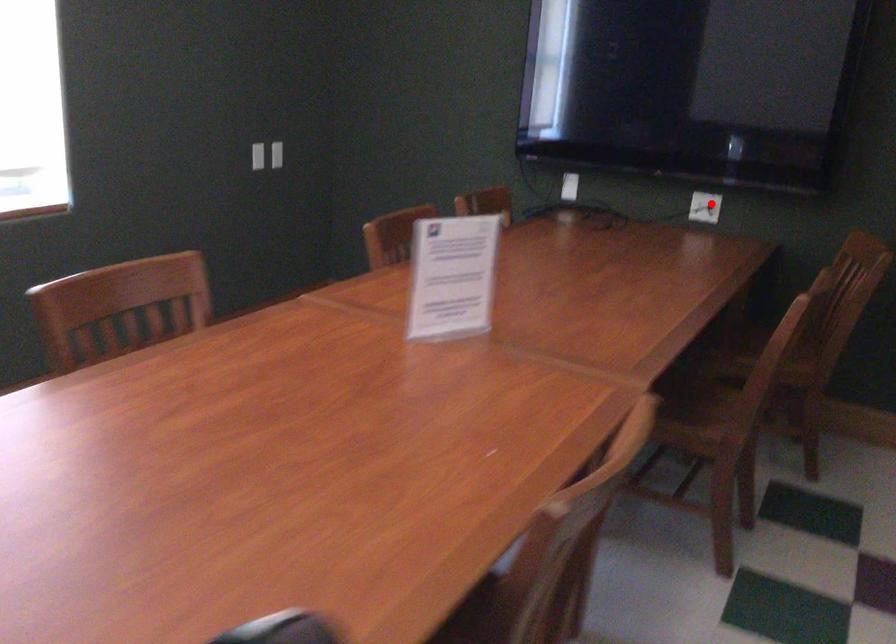
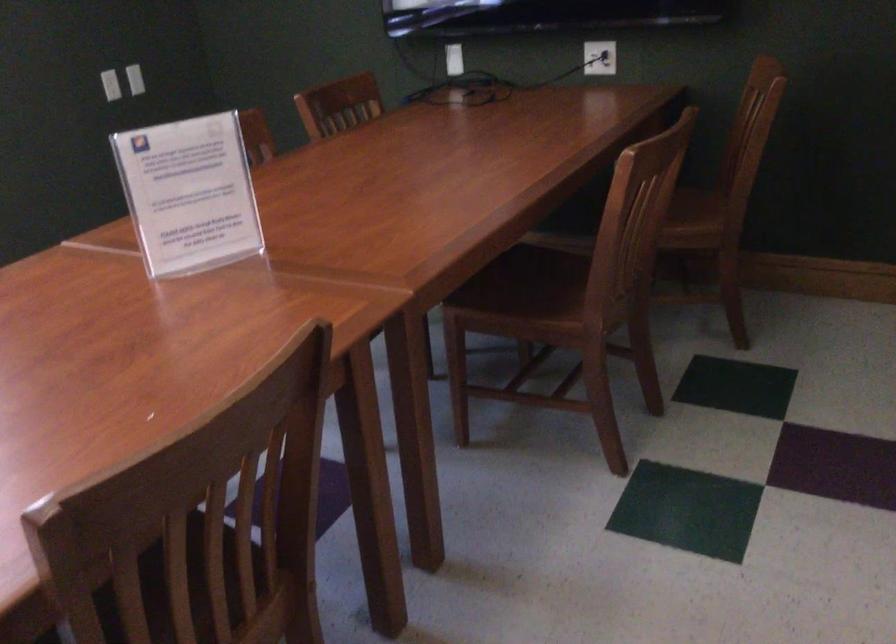
Question: I am providing you with two images of the same scene from different viewpoints. A red point is shown in image1. For the corresponding object point in image2, is it positioned nearer or farther from the camera?

Choices:
 (A) Nearer
 (B) Farther

Answer: (A)